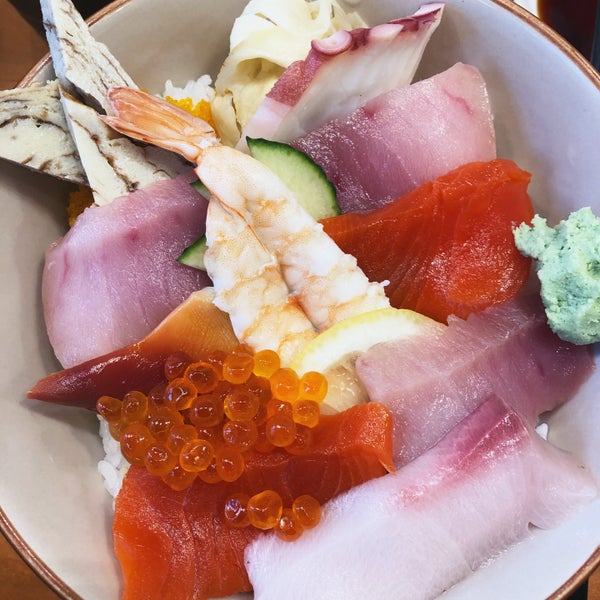
I want to click on plate of gross looking food, so click(x=543, y=127).